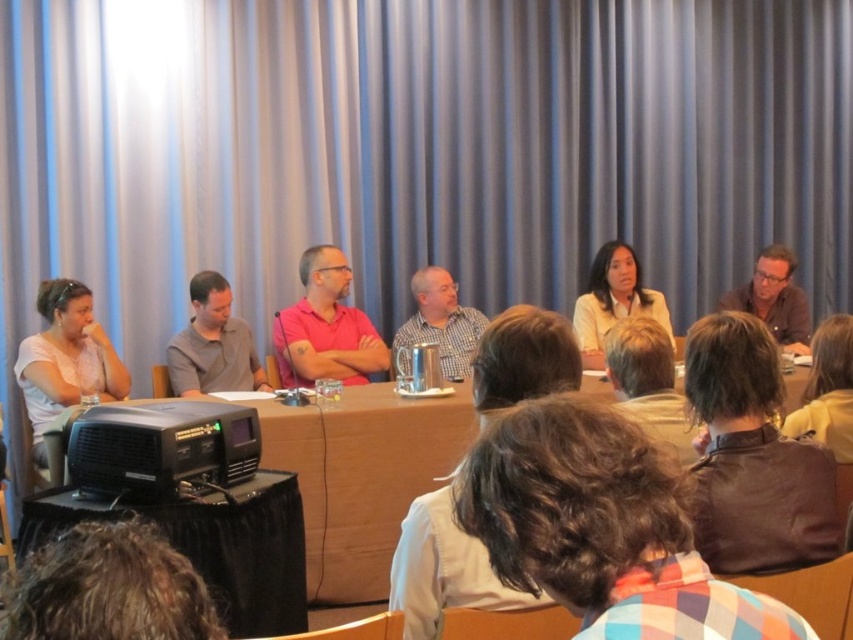
You are sitting in the audience facing the panelists. There are two points marked on the table in front of you. The first point is at coordinate point [641,292] and the second is at point [453,314]. If you want to throw a small object to the point that is closer to you, which coordinate should you aim for?

Point [641,292] is closer to the viewer than point [453,314], so you should aim for point [641,292].

You are an event planner standing at the back of the room and need to hand a document to the white matte shirt at left. The brown wood table at center is in your way. Can you walk around the table to reach them without moving the table?

The brown wood table at center is 3.87 feet away from white matte shirt at left. Since the table is between you and the white matte shirt at left, you can walk around the table to reach them as the distance allows for maneuvering space.

You are sitting in the audience and want to point out the white shirt at center to a friend. Based on the coordinates provided, can you determine if it is closer to the left or right side of the stage?

The white shirt at center is located at point 0.470 on the x and y axis, which is slightly to the right of the center point. Therefore, it is closer to the right side of the stage.